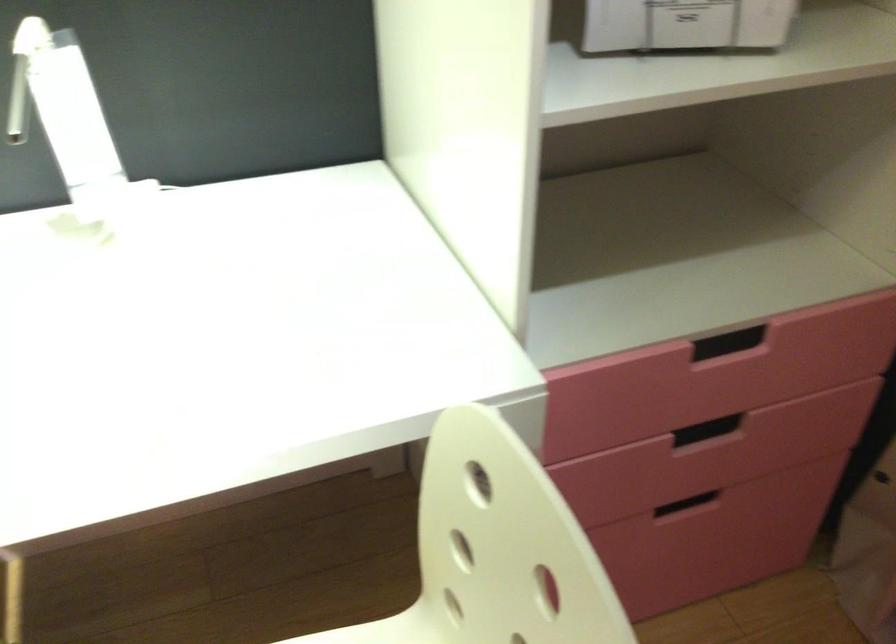
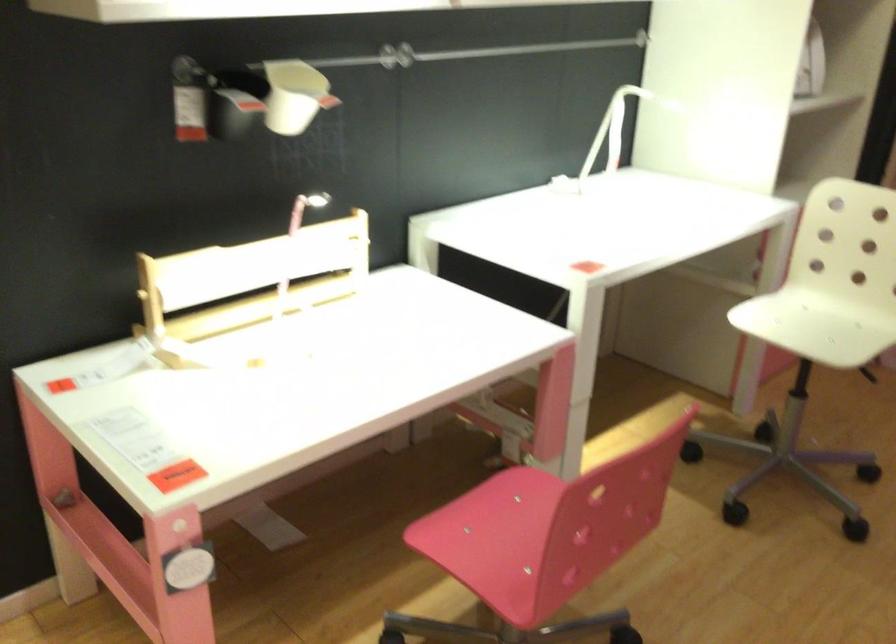
Question: I am providing you with two images of the same scene from different viewpoints. Which of the following objects are not visible in image2?

Choices:
 (A) blue cylinder
 (B) white wall cup
 (C) recessed drawer handle
 (D) black wall container

Answer: (C)